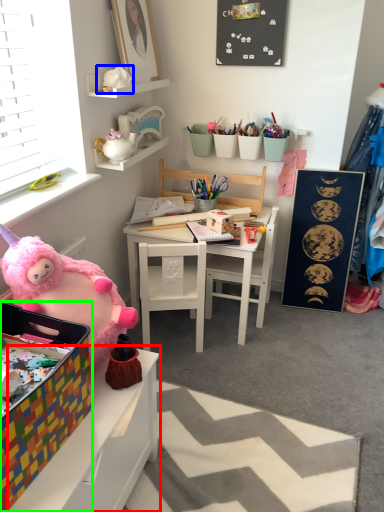
Question: Based on their relative distances, which object is farther from table (highlighted by a red box)? Choose from toy (highlighted by a blue box) and box (highlighted by a green box).

Choices:
 (A) toy
 (B) box

Answer: (A)